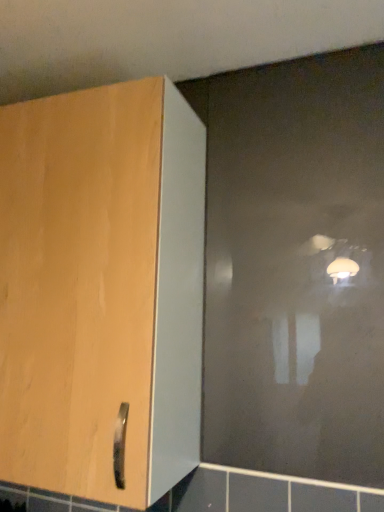
Describe the element at coordinates (12, 502) in the screenshot. I see `matte ceramic tile at lower left` at that location.

Where is `matte wood cupboard at left`? Image resolution: width=384 pixels, height=512 pixels. matte wood cupboard at left is located at coordinates point(101,290).

What are the coordinates of `matte ceramic tile at lower left` in the screenshot? It's located at (12, 502).

The width and height of the screenshot is (384, 512). What are the coordinates of `cupboard to the left of transparent matte glass door at upper right` in the screenshot? It's located at 101,290.

Considering the sizes of objects transparent matte glass door at upper right and matte wood cupboard at left in the image provided, who is taller, transparent matte glass door at upper right or matte wood cupboard at left?

With more height is transparent matte glass door at upper right.

Considering the relative positions of transparent matte glass door at upper right and matte wood cupboard at left in the image provided, is transparent matte glass door at upper right to the right of matte wood cupboard at left from the viewer's perspective?

Indeed, transparent matte glass door at upper right is positioned on the right side of matte wood cupboard at left.

Relative to transparent matte glass door at upper right, is matte ceramic tile at lower left in front or behind?

matte ceramic tile at lower left is behind transparent matte glass door at upper right.

Which of these two, matte ceramic tile at lower left or transparent matte glass door at upper right, is bigger?

With larger size is transparent matte glass door at upper right.

Is matte ceramic tile at lower left facing towards transparent matte glass door at upper right?

No, matte ceramic tile at lower left is not facing towards transparent matte glass door at upper right.

From the image's perspective, between matte ceramic tile at lower left and transparent matte glass door at upper right, who is located below?

matte ceramic tile at lower left, from the image's perspective.

How many degrees apart are the facing directions of transparent matte glass door at upper right and matte ceramic tile at lower left?

They differ by 1.53 degrees in their facing directions.

Based on their sizes in the image, would you say transparent matte glass door at upper right is bigger or smaller than matte ceramic tile at lower left?

transparent matte glass door at upper right is bigger than matte ceramic tile at lower left.

Could you tell me if transparent matte glass door at upper right is facing matte ceramic tile at lower left?

No, transparent matte glass door at upper right is not facing towards matte ceramic tile at lower left.

Is matte wood cupboard at left to the left of transparent matte glass door at upper right from the viewer's perspective?

Indeed, matte wood cupboard at left is positioned on the left side of transparent matte glass door at upper right.

From the image's perspective, is matte wood cupboard at left positioned above or below transparent matte glass door at upper right?

Based on their image positions, matte wood cupboard at left is located beneath transparent matte glass door at upper right.

Between matte wood cupboard at left and transparent matte glass door at upper right, which one has smaller width?

transparent matte glass door at upper right.

Is point (29, 429) behind point (345, 117)?

No, (29, 429) is closer to viewer.

Identify the location of cupboard that is above the matte ceramic tile at lower left (from the image's perspective). The height and width of the screenshot is (512, 384). (101, 290).

Which is more to the right, matte ceramic tile at lower left or matte wood cupboard at left?

matte wood cupboard at left is more to the right.

Considering the positions of points (23, 505) and (77, 334), is point (23, 505) farther from camera compared to point (77, 334)?

Yes, it is.

In terms of width, does matte ceramic tile at lower left look wider or thinner when compared to matte wood cupboard at left?

In the image, matte ceramic tile at lower left appears to be more narrow than matte wood cupboard at left.

From a real-world perspective, is matte wood cupboard at left above or below matte ceramic tile at lower left?

In terms of real-world spatial position, matte wood cupboard at left is above matte ceramic tile at lower left.

Looking at this image, which object is closer to the camera, matte wood cupboard at left or matte ceramic tile at lower left?

matte wood cupboard at left is more forward.

Based on their sizes in the image, would you say matte wood cupboard at left is bigger or smaller than matte ceramic tile at lower left?

Clearly, matte wood cupboard at left is larger in size than matte ceramic tile at lower left.

Where is `cupboard below the transparent matte glass door at upper right (from the image's perspective)`? The image size is (384, 512). cupboard below the transparent matte glass door at upper right (from the image's perspective) is located at coordinates (101, 290).

Where is `glass door lying above the matte ceramic tile at lower left (from the image's perspective)`? Image resolution: width=384 pixels, height=512 pixels. glass door lying above the matte ceramic tile at lower left (from the image's perspective) is located at coordinates (295, 266).

Estimate the real-world distances between objects in this image. Which object is further from matte ceramic tile at lower left, matte wood cupboard at left or transparent matte glass door at upper right?

transparent matte glass door at upper right is further to matte ceramic tile at lower left.

From the image, which object appears to be farther from matte wood cupboard at left, matte ceramic tile at lower left or transparent matte glass door at upper right?

Among the two, matte ceramic tile at lower left is located further to matte wood cupboard at left.

When comparing their distances from transparent matte glass door at upper right, does matte ceramic tile at lower left or matte wood cupboard at left seem further?

The object further to transparent matte glass door at upper right is matte ceramic tile at lower left.

When comparing their distances from transparent matte glass door at upper right, does matte wood cupboard at left or matte ceramic tile at lower left seem further?

matte ceramic tile at lower left lies further to transparent matte glass door at upper right than the other object.

From the picture: Estimate the real-world distances between objects in this image. Which object is further from matte wood cupboard at left, transparent matte glass door at upper right or matte ceramic tile at lower left?

matte ceramic tile at lower left is positioned further to the anchor matte wood cupboard at left.

When comparing their distances from matte ceramic tile at lower left, does transparent matte glass door at upper right or matte wood cupboard at left seem closer?

The object closer to matte ceramic tile at lower left is matte wood cupboard at left.

Identify the location of cupboard between transparent matte glass door at upper right and matte ceramic tile at lower left vertically. (101, 290).